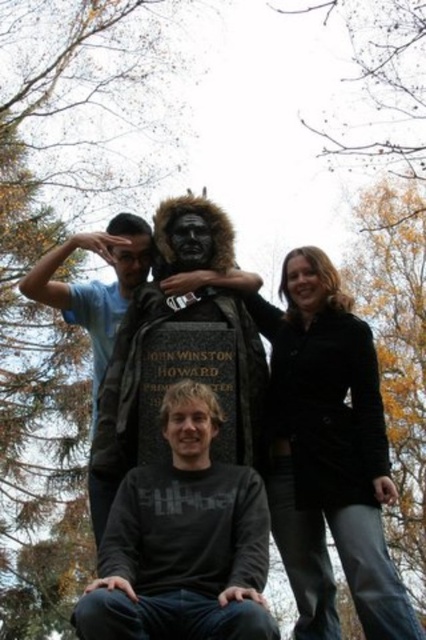
Question: Which object is the farthest from the black woolen coat at upper right?

Choices:
 (A) dark gray cotton shirt at center
 (B) smooth black hair at upper right
 (C) light blue t-shirt at left

Answer: (C)

Question: Based on their relative distances, which object is nearer to the matte black mask at center?

Choices:
 (A) smooth black hair at upper right
 (B) dark gray cotton shirt at center
 (C) black woolen coat at upper right
 (D) matte black bust at center

Answer: (D)

Question: Is dark gray cotton shirt at center above smooth black hair at upper right?

Choices:
 (A) no
 (B) yes

Answer: (A)

Question: Does black woolen coat at upper right appear over matte black bust at center?

Choices:
 (A) no
 (B) yes

Answer: (A)

Question: Does matte black bust at center have a larger size compared to matte black mask at center?

Choices:
 (A) yes
 (B) no

Answer: (B)

Question: Which object is farther from the camera taking this photo?

Choices:
 (A) dark gray cotton shirt at center
 (B) shiny black statue at center

Answer: (B)